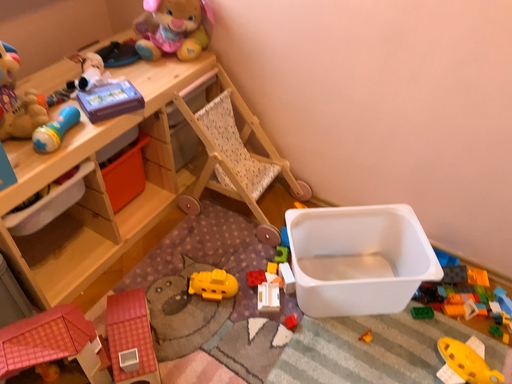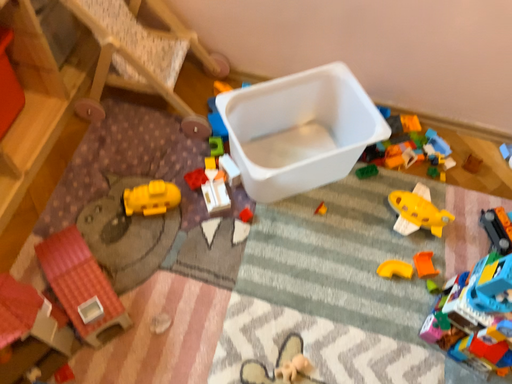
Question: How did the camera likely rotate when shooting the video?

Choices:
 (A) rotated upward
 (B) rotated downward

Answer: (B)